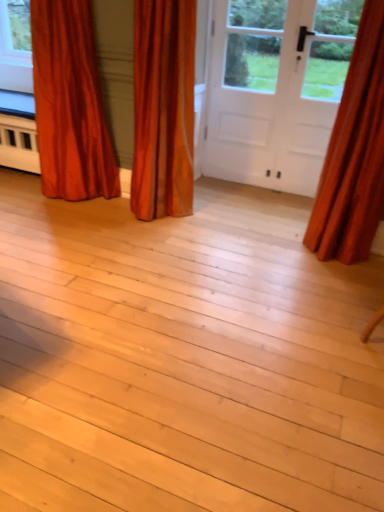
Question: Looking at their shapes, would you say satin orange curtain at right, which is the third curtain from left to right, is wider or thinner than satin orange curtain at center, acting as the 2th curtain starting from the left?

Choices:
 (A) thin
 (B) wide

Answer: (A)

Question: From a real-world perspective, relative to satin orange curtain at center, the 2th curtain viewed from the right, is satin orange curtain at right, which is the third curtain from left to right, vertically above or below?

Choices:
 (A) below
 (B) above

Answer: (B)

Question: Which object is positioned closest to the white matte door at center?

Choices:
 (A) satin orange curtain at right, arranged as the 1th curtain when viewed from the right
 (B) satin orange curtain at center, the 2th curtain viewed from the right
 (C) velvet orange curtain at left, which appears as the third curtain when viewed from the right

Answer: (B)

Question: Considering the real-world distances, which object is farthest from the velvet orange curtain at left, marked as the first curtain in a left-to-right arrangement?

Choices:
 (A) satin orange curtain at center, acting as the 2th curtain starting from the left
 (B) satin orange curtain at right, which is the third curtain from left to right
 (C) white matte door at center

Answer: (B)